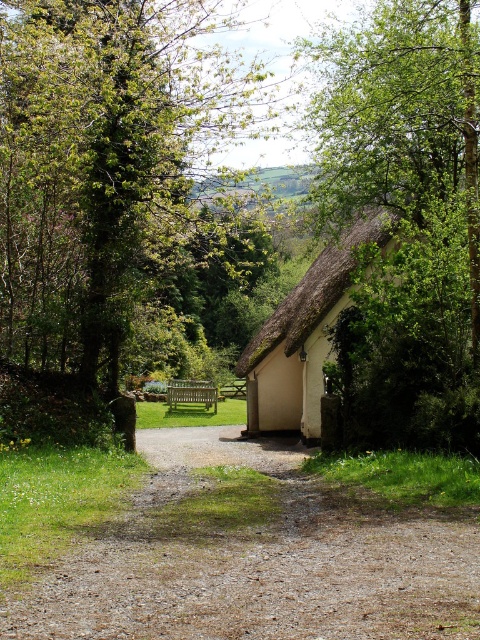
Does gravel at center appear over wooden picnic table at center?

Yes.

Is the position of gravel at center less distant than that of wooden picnic table at center?

Yes, gravel at center is closer to the viewer.

What do you see at coordinates (257, 561) in the screenshot? This screenshot has height=640, width=480. I see `gravel at center` at bounding box center [257, 561].

What are the coordinates of `gravel at center` in the screenshot? It's located at (257, 561).

Can you confirm if green leafy tree at upper left is positioned to the right of gravel at center?

No, green leafy tree at upper left is not to the right of gravel at center.

Who is higher up, green leafy tree at upper left or gravel at center?

green leafy tree at upper left is higher up.

Is point (87, 392) closer to viewer compared to point (279, 540)?

No, (87, 392) is further to viewer.

The height and width of the screenshot is (640, 480). In order to click on green leafy tree at upper left in this screenshot , I will do `click(110, 204)`.

Does green leafy tree at upper left have a greater height compared to wooden picnic table at center?

Yes, green leafy tree at upper left is taller than wooden picnic table at center.

Locate an element on the screen. The image size is (480, 640). green leafy tree at upper left is located at coordinates (110, 204).

Is point (83, 374) positioned behind point (228, 387)?

No, it is in front of (228, 387).

You are a GUI agent. You are given a task and a screenshot of the screen. Output one action in this format:
    pyautogui.click(x=<x>, y=<y>)
    Task: Click on the green leafy tree at upper left
    The height and width of the screenshot is (640, 480).
    Given the screenshot: What is the action you would take?
    pyautogui.click(x=110, y=204)